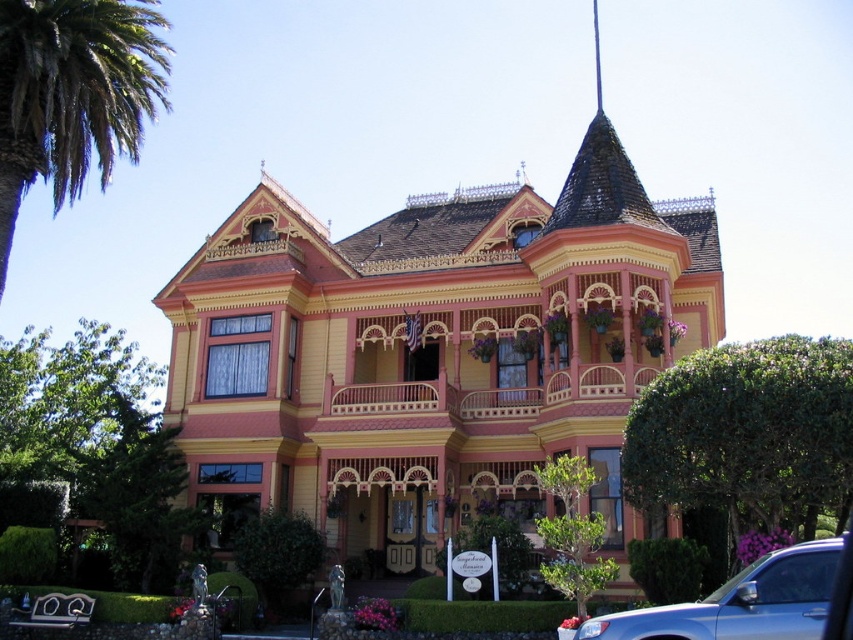
Question: Among these points, which one is farthest from the camera?

Choices:
 (A) (793, 589)
 (B) (3, 32)

Answer: (B)

Question: Is green leafy palm at upper left bigger than blue metallic car at lower right?

Choices:
 (A) no
 (B) yes

Answer: (B)

Question: Does green leafy palm at upper left have a larger size compared to blue metallic car at lower right?

Choices:
 (A) no
 (B) yes

Answer: (B)

Question: Is green leafy palm at upper left thinner than blue metallic car at lower right?

Choices:
 (A) yes
 (B) no

Answer: (B)